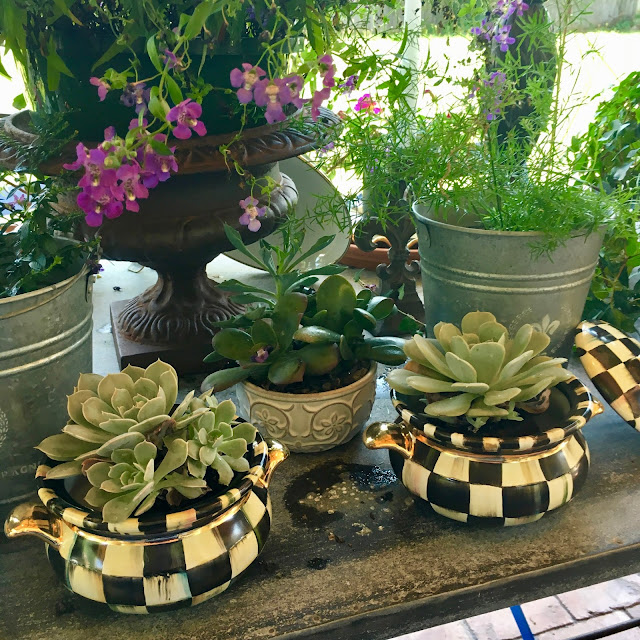
Image resolution: width=640 pixels, height=640 pixels. In order to click on table in this screenshot , I will do `click(592, 518)`, `click(522, 547)`.